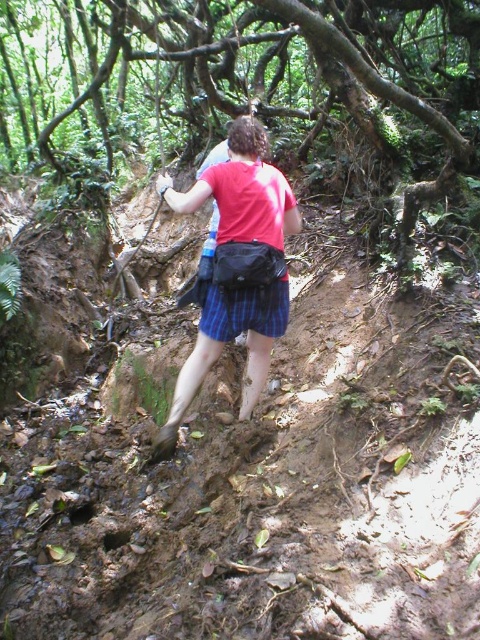
Question: Is matte red shirt at center to the right of blue striped kilt at center from the viewer's perspective?

Choices:
 (A) no
 (B) yes

Answer: (A)

Question: Does matte red shirt at center appear on the right side of blue striped kilt at center?

Choices:
 (A) no
 (B) yes

Answer: (A)

Question: Which point is farther from the camera taking this photo?

Choices:
 (A) (238, 131)
 (B) (256, 332)

Answer: (B)

Question: Can you confirm if matte red shirt at center is wider than blue striped kilt at center?

Choices:
 (A) yes
 (B) no

Answer: (A)